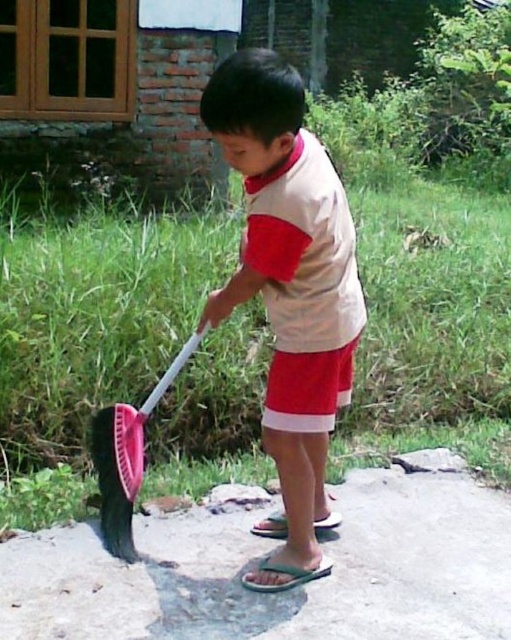
Question: Does smooth concrete pavement at lower center appear on the left side of red cotton shorts at center?

Choices:
 (A) yes
 (B) no

Answer: (B)

Question: Which object is the closest to the green grass at lower left?

Choices:
 (A) white cotton shirt at center
 (B) red cotton shorts at center
 (C) pink plastic shovel at lower left

Answer: (C)

Question: Does smooth concrete pavement at lower center have a larger size compared to pink plastic shovel at lower left?

Choices:
 (A) yes
 (B) no

Answer: (A)

Question: Which object is the closest to the white cotton shirt at center?

Choices:
 (A) green grass at lower left
 (B) smooth concrete pavement at lower center
 (C) pink plastic shovel at lower left

Answer: (C)

Question: Which of the following is the closest to the observer?

Choices:
 (A) white cotton shirt at center
 (B) green grass at lower left
 (C) smooth concrete pavement at lower center
 (D) pink plastic shovel at lower left

Answer: (A)

Question: Does green grass at lower left have a greater width compared to red cotton shorts at center?

Choices:
 (A) no
 (B) yes

Answer: (B)